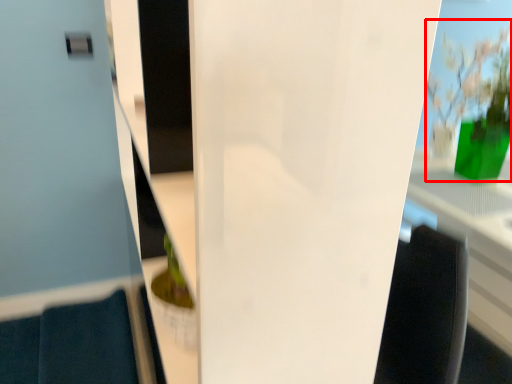
Question: From the image, what is the correct spatial relationship of floral arrangement (annotated by the red box) in relation to glass door?

Choices:
 (A) right
 (B) left

Answer: (A)